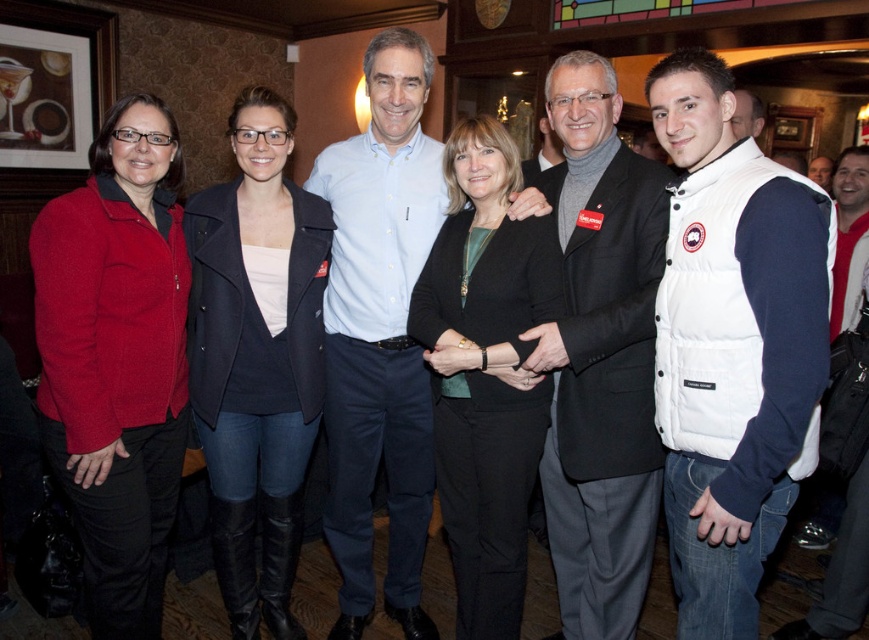
You are a photographer adjusting your camera to capture the group photo. You notice the matte red jacket at left and the dark gray wool suit at center. Based on their positions, which one is closer to the camera?

The matte red jacket at left is located above the dark gray wool suit at center, meaning it is closer to the camera.